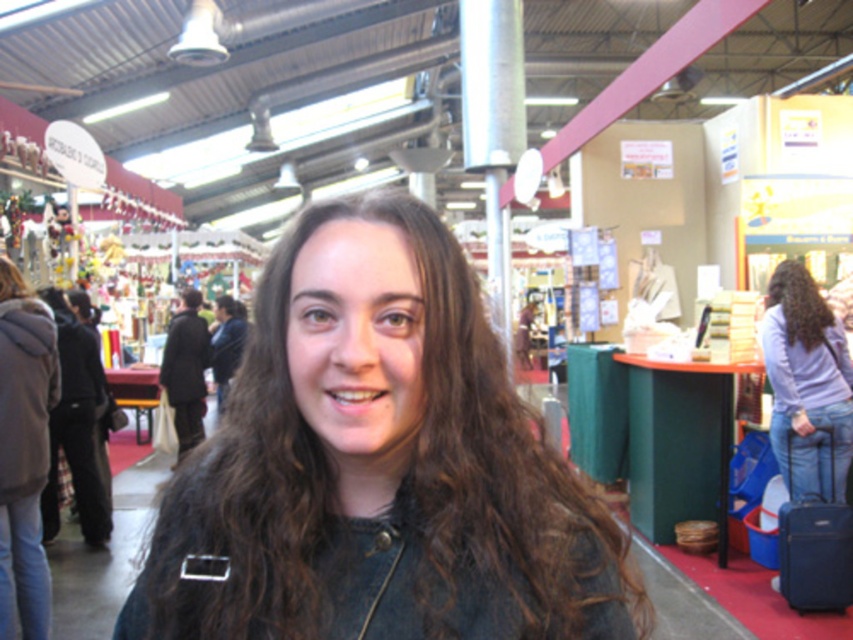
You are a photographer trying to capture the scene of the lively indoor market. You notice the dark brown hair at center and the light purple fabric at center. Which object should you focus on if you want to highlight something larger in the frame?

The light purple fabric at center is larger than the dark brown hair at center, so focusing on it would highlight a larger object in the frame.

You are a photographer standing in the market and want to capture a photo of both the dark brown hair at center and the light purple fabric at center. Which object will appear larger in the photo?

The dark brown hair at center will appear larger in the photo because it is closer to the viewer than the light purple fabric at center.

You are a customer at the market and want to pick up the fuzzy gray coat at left and the light purple fabric at center. Which item should you look for first if you are standing at the entrance facing the market?

You should look for the fuzzy gray coat at left first because it is located below the light purple fabric at center, meaning it is lower in position and closer to your eye level when standing.